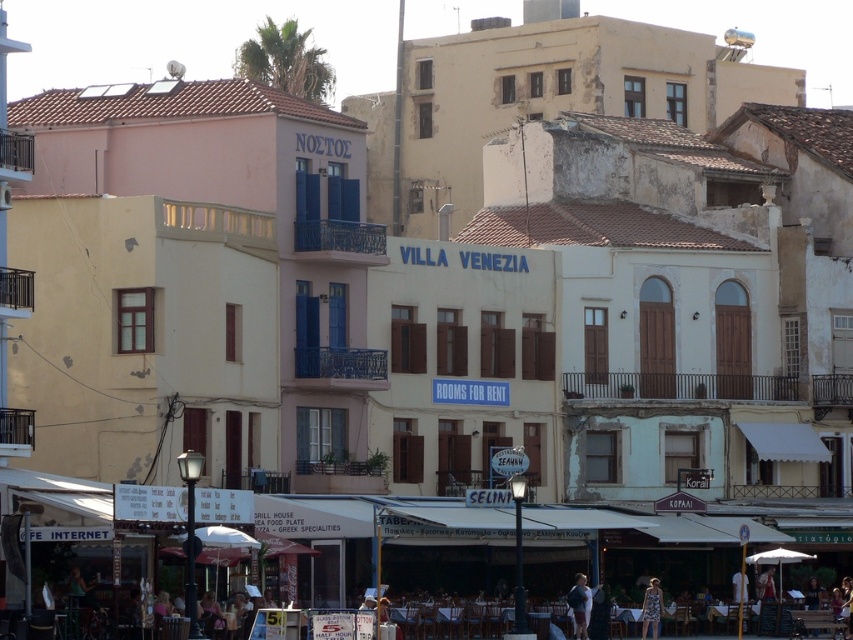
You are a tourist standing on the street in front of the VILLA VENEZIA building. You see a light blue fabric dress at lower center and a printed fabric dress at lower right. Which dress is closer to you?

The light blue fabric dress at lower center is closer to you because it is further to the viewer than the printed fabric dress at lower right.

You are a tourist standing at the entrance of the street in the image. You want to find the light blue fabric dress at lower center. Based on the coordinates provided, in which direction should you look to locate it?

The light blue fabric dress at lower center is located at point 0.945 on the x axis and 0.680 on the y axis. Since the coordinates are given in normalized values between 0 and 1, the dress is positioned towards the lower right part of the image. Therefore, you should look towards the lower right direction to locate it.